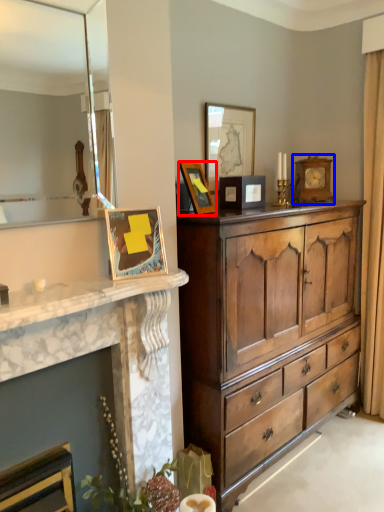
Question: Which object is further to the camera taking this photo, picture frame (highlighted by a red box) or picture frame (highlighted by a blue box)?

Choices:
 (A) picture frame
 (B) picture frame

Answer: (B)